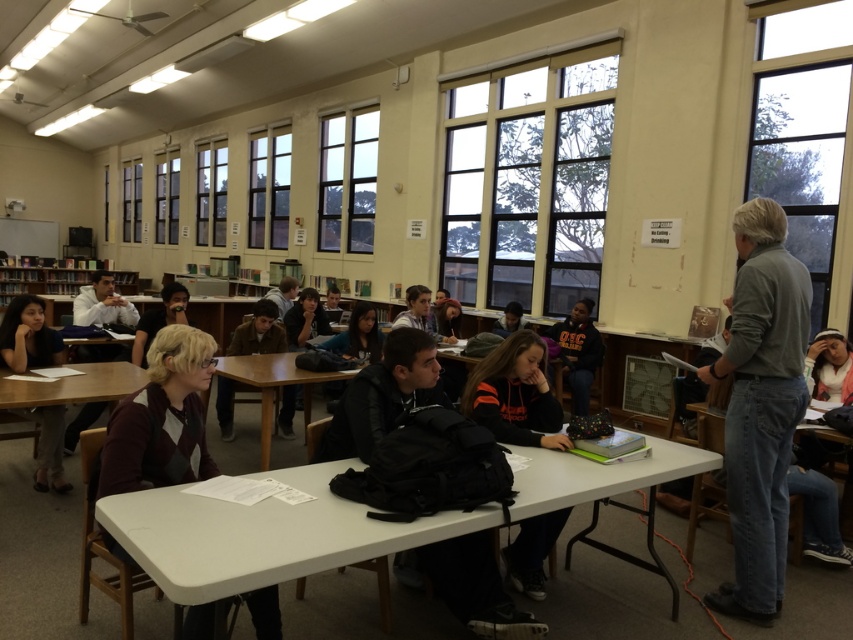
Question: Observing the image, what is the correct spatial positioning of wooden table at center in reference to white plastic table at lower left?

Choices:
 (A) left
 (B) right

Answer: (B)

Question: Does white plastic table at center appear on the right side of orange hoodie at center?

Choices:
 (A) no
 (B) yes

Answer: (A)

Question: Based on their relative distances, which object is farther from the white plastic table at lower left?

Choices:
 (A) maroon sweater at center
 (B) wooden table at center
 (C) orange hoodie at center

Answer: (C)

Question: Observing the image, what is the correct spatial positioning of white plastic table at center in reference to maroon sweater at center?

Choices:
 (A) above
 (B) below

Answer: (B)

Question: Which object is farther from the camera taking this photo?

Choices:
 (A) orange hoodie at center
 (B) white plastic table at lower left
 (C) dark brown hair at lower left
 (D) maroon sweater at center

Answer: (C)

Question: Which object is farther from the camera taking this photo?

Choices:
 (A) gray cotton shirt at right
 (B) white plastic table at center
 (C) maroon sweater at center

Answer: (A)